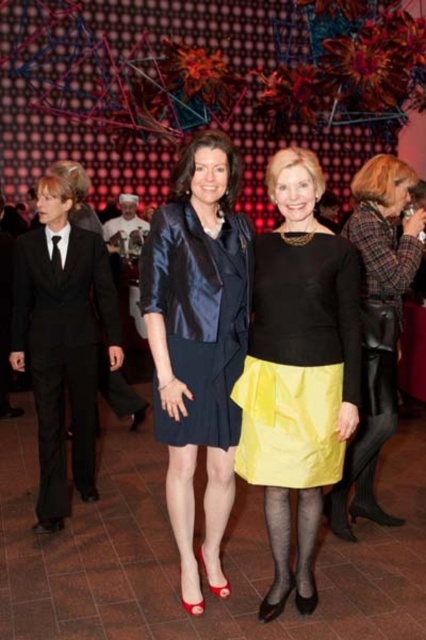
Question: Which point is farther to the camera?

Choices:
 (A) matte yellow skirt at center
 (B) black suit at left
 (C) satin blue dress at center

Answer: (B)

Question: Which point is farther to the camera?

Choices:
 (A) (284, 604)
 (B) (85, 355)

Answer: (B)

Question: Which of the following is the farthest from the observer?

Choices:
 (A) satin blue dress at center
 (B) yellow satin skirt at center

Answer: (B)

Question: Can you confirm if matte yellow skirt at center is thinner than satin blue dress at center?

Choices:
 (A) yes
 (B) no

Answer: (B)

Question: Does matte yellow skirt at center appear on the right side of yellow satin skirt at center?

Choices:
 (A) no
 (B) yes

Answer: (A)

Question: Is matte yellow skirt at center positioned in front of black suit at left?

Choices:
 (A) yes
 (B) no

Answer: (A)